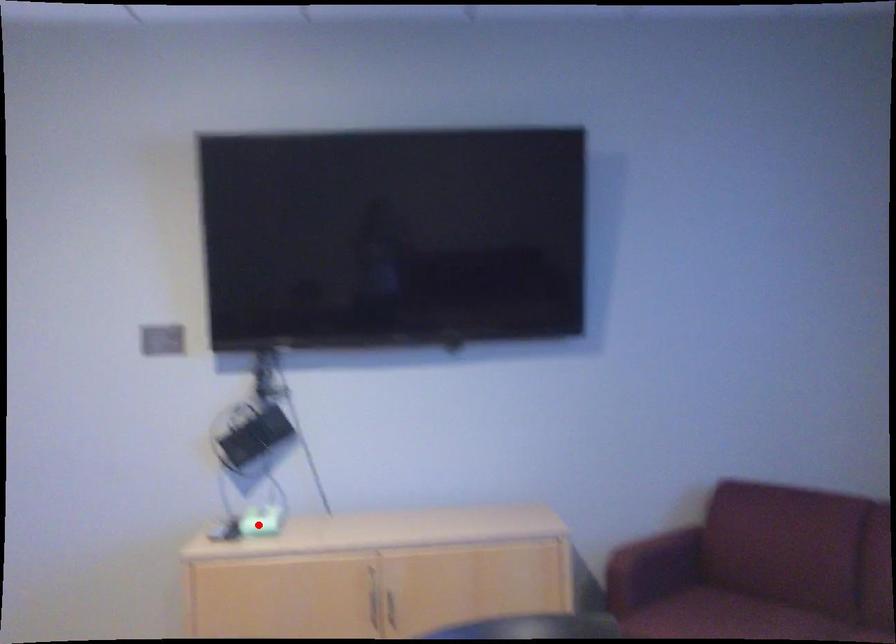
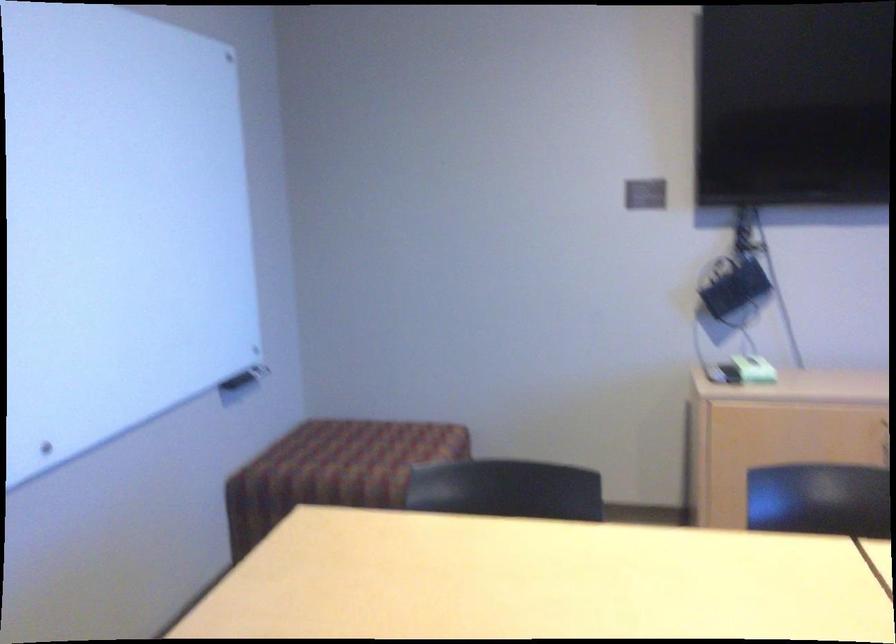
In the second image, find the point that corresponds to the highlighted location in the first image.

(754, 368)